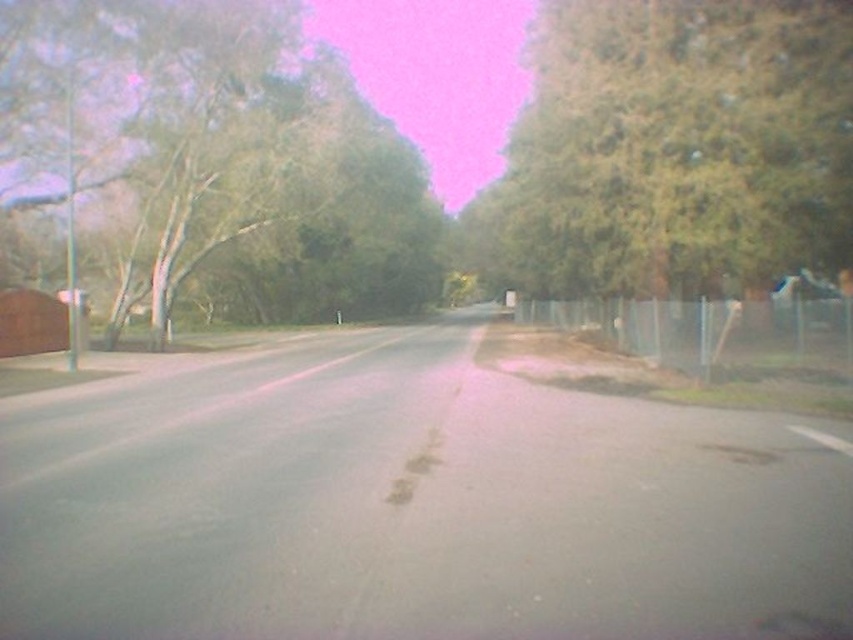
Looking at this image, can you confirm if green leafy tree at right is positioned to the right of metallic silver fence at right?

In fact, green leafy tree at right is to the left of metallic silver fence at right.

Is green leafy tree at right taller than metallic silver fence at right?

Yes.

The height and width of the screenshot is (640, 853). Describe the element at coordinates (672, 148) in the screenshot. I see `green leafy tree at right` at that location.

Image resolution: width=853 pixels, height=640 pixels. What are the coordinates of `green leafy tree at right` in the screenshot? It's located at (672, 148).

How distant is green leafy tree at left from metallic silver fence at right?

green leafy tree at left is 62.38 feet from metallic silver fence at right.

Does green leafy tree at left appear over metallic silver fence at right?

Indeed, green leafy tree at left is positioned over metallic silver fence at right.

What do you see at coordinates (206, 164) in the screenshot? The image size is (853, 640). I see `green leafy tree at left` at bounding box center [206, 164].

At what (x,y) coordinates should I click in order to perform the action: click on green leafy tree at left. Please return your answer as a coordinate pair (x, y). This screenshot has height=640, width=853. Looking at the image, I should click on (206, 164).

Is green leafy tree at left below green leafy tree at right?

Correct, green leafy tree at left is located below green leafy tree at right.

I want to click on green leafy tree at left, so click(x=206, y=164).

Does point (167, 312) lie behind point (627, 280)?

Yes, point (167, 312) is behind point (627, 280).

At what (x,y) coordinates should I click in order to perform the action: click on green leafy tree at left. Please return your answer as a coordinate pair (x, y). The width and height of the screenshot is (853, 640). Looking at the image, I should click on (206, 164).